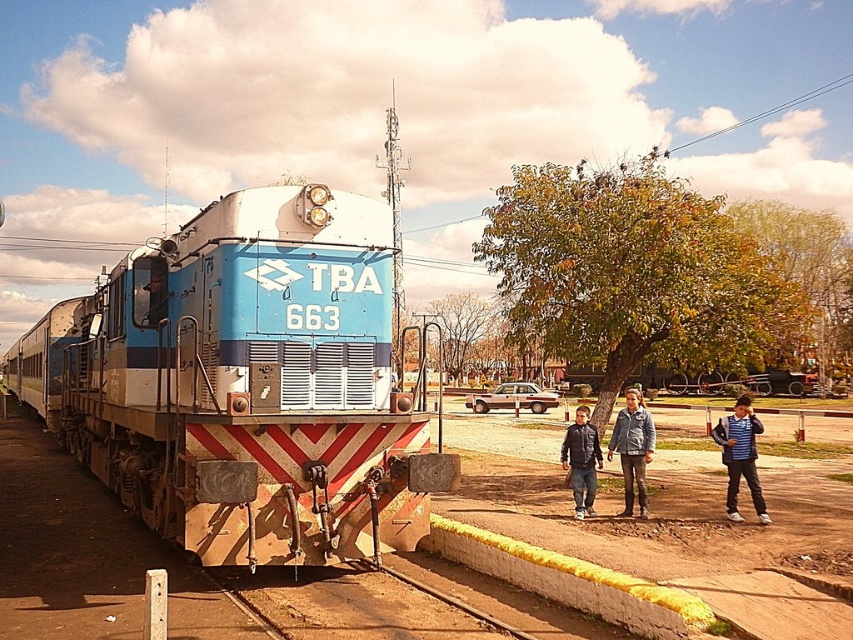
Between leather jacket at center and matte brown sedan at center, which one is positioned higher?

leather jacket at center is above.

Where is `leather jacket at center`? This screenshot has height=640, width=853. leather jacket at center is located at coordinates (x=581, y=461).

Find the location of a particular element. leather jacket at center is located at coordinates (581, 461).

Which is more to the right, denim jacket at center or leather jacket at center?

denim jacket at center is more to the right.

What do you see at coordinates (633, 449) in the screenshot? The image size is (853, 640). I see `denim jacket at center` at bounding box center [633, 449].

Image resolution: width=853 pixels, height=640 pixels. I want to click on denim jacket at center, so click(633, 449).

Is brown dirt train track at lower center wider than denim jacket at center?

Yes, brown dirt train track at lower center is wider than denim jacket at center.

Is brown dirt train track at lower center to the left of denim jacket at center from the viewer's perspective?

Correct, you'll find brown dirt train track at lower center to the left of denim jacket at center.

At what (x,y) coordinates should I click in order to perform the action: click on brown dirt train track at lower center. Please return your answer as a coordinate pair (x, y). The image size is (853, 640). Looking at the image, I should click on (357, 604).